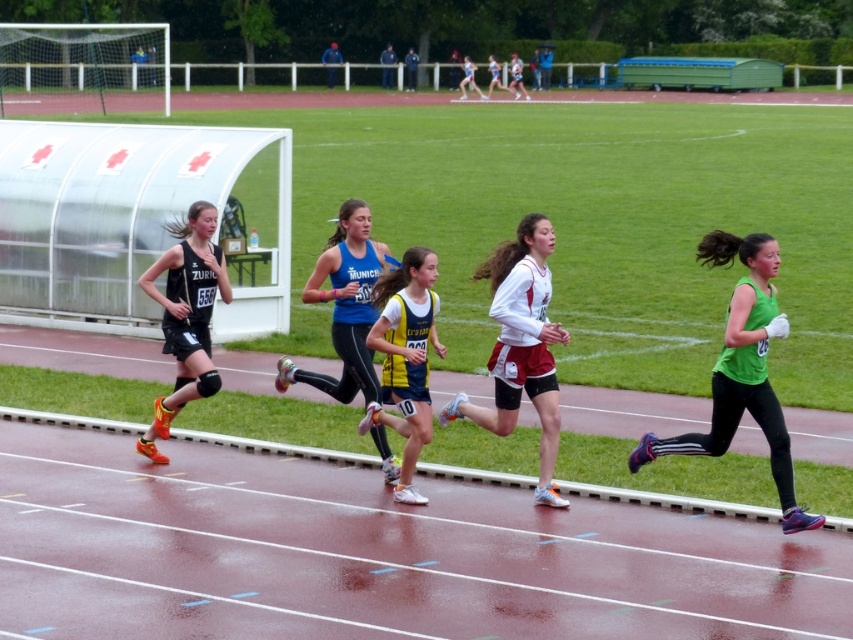
In the scene shown: Can you confirm if green matte tank top at right is wider than yellow and blue jersey at center?

Correct, the width of green matte tank top at right exceeds that of yellow and blue jersey at center.

Describe the element at coordinates (741, 371) in the screenshot. This screenshot has width=853, height=640. I see `green matte tank top at right` at that location.

Between point (643, 460) and point (397, 404), which one is positioned behind?

The point (643, 460) is behind.

What are the coordinates of `green matte tank top at right` in the screenshot? It's located at (741, 371).

Does green matte tank top at right appear on the left side of blue fabric tank top at center?

Incorrect, green matte tank top at right is not on the left side of blue fabric tank top at center.

Does green matte tank top at right appear over blue fabric tank top at center?

Actually, green matte tank top at right is below blue fabric tank top at center.

Where is `green matte tank top at right`? Image resolution: width=853 pixels, height=640 pixels. green matte tank top at right is located at coordinates (741, 371).

Which of these two, blue fabric tank top at center or matte black shorts at left, stands shorter?

blue fabric tank top at center

Who is more distant from viewer, (335, 276) or (209, 374)?

The point (209, 374) is more distant.

This screenshot has height=640, width=853. I want to click on blue fabric tank top at center, so click(345, 307).